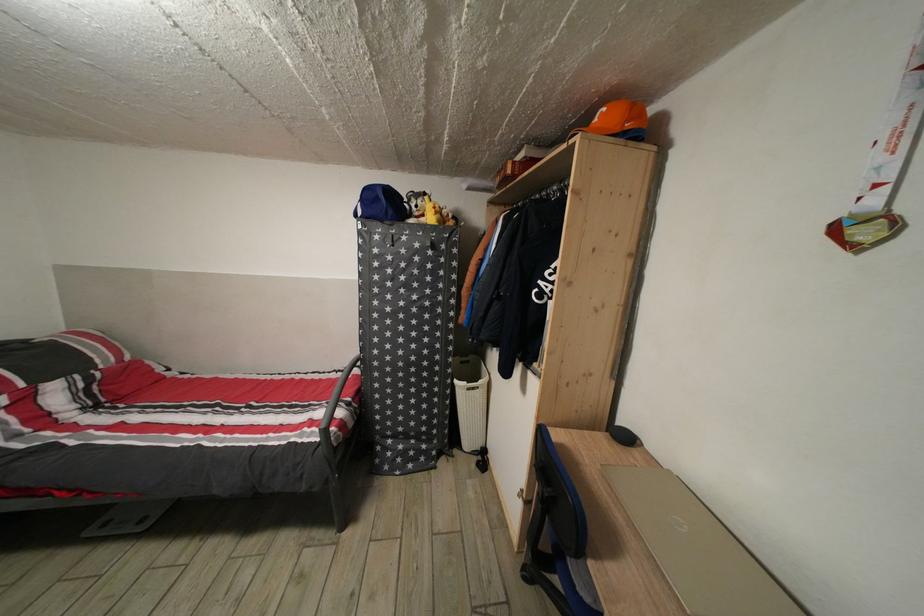
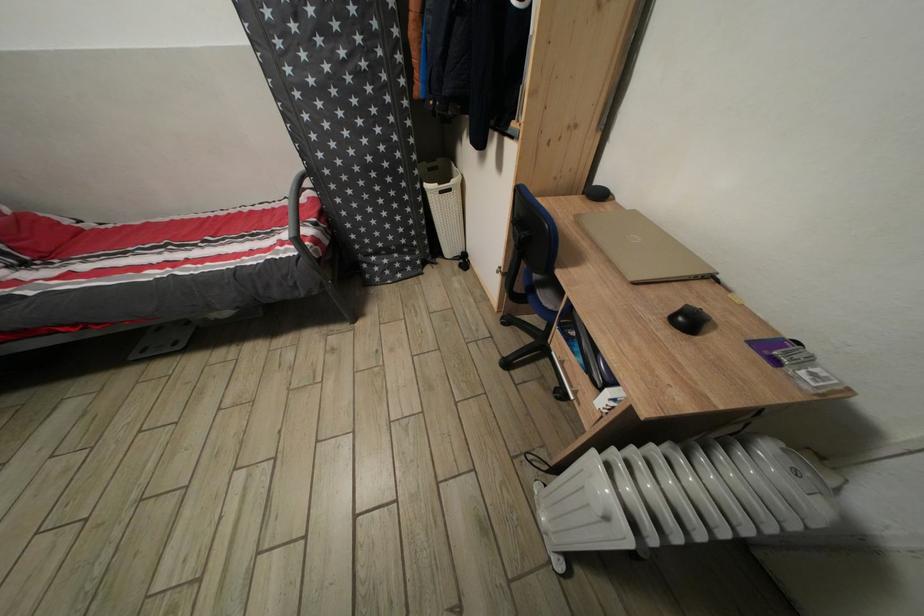
Locate, in the second image, the point that corresponds to point 339,382 in the first image.

(294, 209)